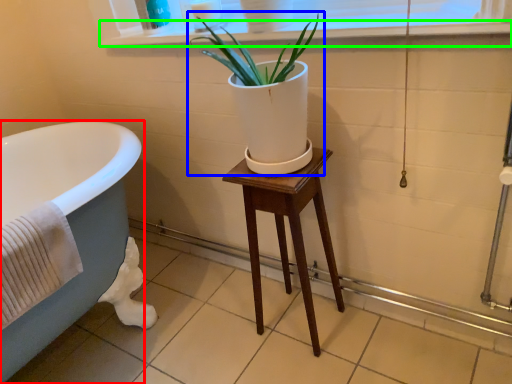
Question: Estimate the real-world distances between objects in this image. Which object is closer to bathtub (highlighted by a red box), houseplant (highlighted by a blue box) or window sill (highlighted by a green box)?

Choices:
 (A) houseplant
 (B) window sill

Answer: (A)